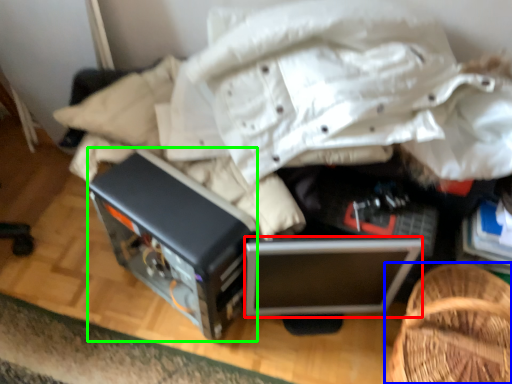
Question: Which object is the farthest from computer (highlighted by a red box)? Choose among these: furniture (highlighted by a blue box) or appliance (highlighted by a green box).

Choices:
 (A) furniture
 (B) appliance

Answer: (B)